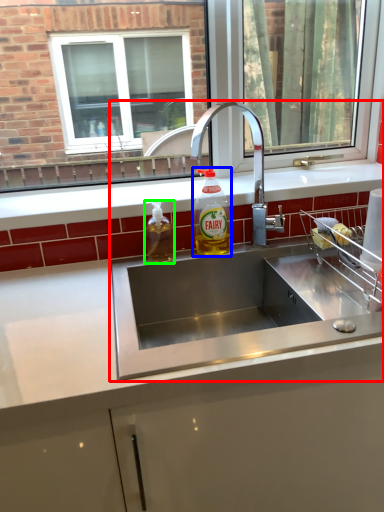
Question: Which object is positioned farthest from sink (highlighted by a red box)? Select from bottle (highlighted by a blue box) and bottle (highlighted by a green box).

Choices:
 (A) bottle
 (B) bottle

Answer: (B)